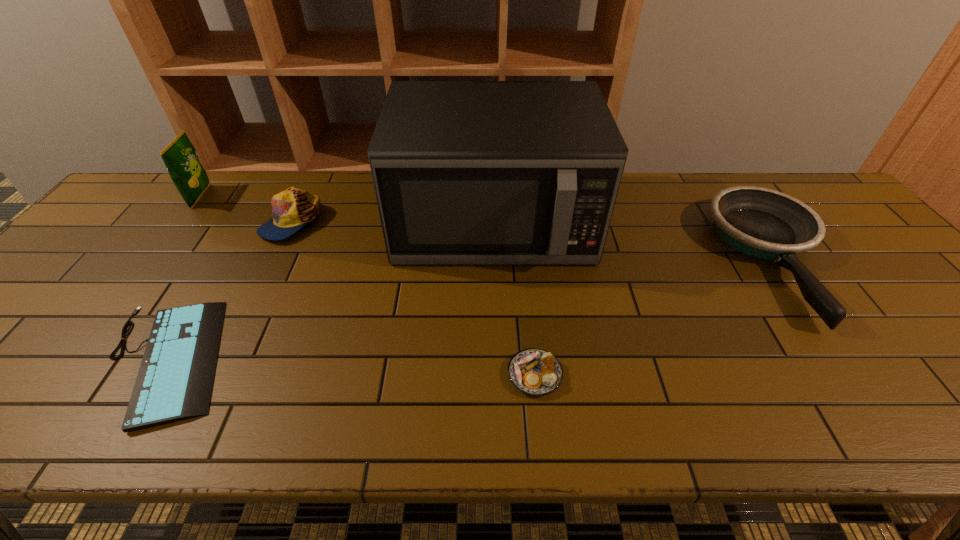
The image size is (960, 540). Identify the location of free spot at the far edge of the desktop. tap(367, 180).

In the image, there is a desktop. Where is `free region at the near edge`? This screenshot has width=960, height=540. free region at the near edge is located at coordinates (283, 401).

Find the location of a particular element. vacant space at the left edge of the desktop is located at coordinates (37, 301).

In the image, there is a desktop. Where is `vacant space at the right edge`? This screenshot has width=960, height=540. vacant space at the right edge is located at coordinates 946,372.

Find the location of a particular element. The image size is (960, 540). free spot at the far right corner of the desktop is located at coordinates (816, 193).

Where is `vacant region between the tallest object and the frying pan`? This screenshot has width=960, height=540. vacant region between the tallest object and the frying pan is located at coordinates (634, 240).

Locate an element on the screen. free space that is in between the fourth shortest object and the pastry is located at coordinates (413, 298).

Locate an element on the screen. The height and width of the screenshot is (540, 960). free space between the tallest object and the fifth tallest object is located at coordinates (514, 298).

Where is `vacant region between the computer keyboard and the microwave oven`? This screenshot has width=960, height=540. vacant region between the computer keyboard and the microwave oven is located at coordinates (330, 291).

This screenshot has width=960, height=540. Find the location of `vacant space that is in between the crisp (potato chip) and the shortest object`. vacant space that is in between the crisp (potato chip) and the shortest object is located at coordinates (183, 279).